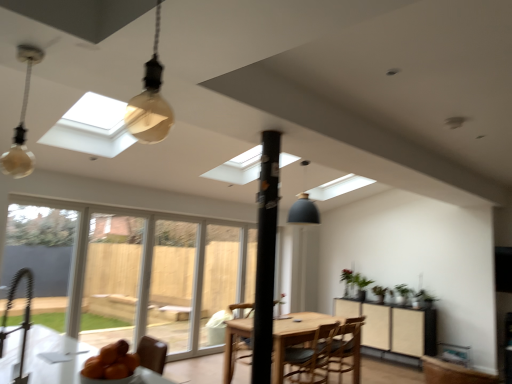
Question: Is transparent plastic screen door at center, which is counted as the 3th screen door, starting from the front, next to matte glass bulb at upper left?

Choices:
 (A) no
 (B) yes

Answer: (A)

Question: Can you confirm if transparent plastic screen door at center, which is counted as the 3th screen door, starting from the front, is wider than matte glass bulb at upper left?

Choices:
 (A) no
 (B) yes

Answer: (A)

Question: Is transparent plastic screen door at center, which is counted as the 3th screen door, starting from the front, closer to camera compared to matte glass bulb at upper left?

Choices:
 (A) no
 (B) yes

Answer: (A)

Question: Can you confirm if transparent plastic screen door at center, positioned as the first screen door in right-to-left order, is smaller than matte glass bulb at upper left?

Choices:
 (A) no
 (B) yes

Answer: (A)

Question: From a real-world perspective, does transparent plastic screen door at center, the third screen door when ordered from left to right, sit lower than matte glass bulb at upper left?

Choices:
 (A) yes
 (B) no

Answer: (A)

Question: Is transparent plastic screen door at center, positioned as the first screen door in right-to-left order, to the right of matte glass bulb at upper left from the viewer's perspective?

Choices:
 (A) no
 (B) yes

Answer: (B)

Question: From a real-world perspective, is transparent plastic screen door at center, the third screen door when ordered from left to right, located higher than green matte plant at right?

Choices:
 (A) yes
 (B) no

Answer: (B)

Question: Is transparent plastic screen door at center, positioned as the first screen door in right-to-left order, bigger than green matte plant at right?

Choices:
 (A) yes
 (B) no

Answer: (A)

Question: Considering the relative sizes of transparent plastic screen door at center, which is counted as the 3th screen door, starting from the front, and green matte plant at right in the image provided, is transparent plastic screen door at center, which is counted as the 3th screen door, starting from the front, taller than green matte plant at right?

Choices:
 (A) yes
 (B) no

Answer: (A)

Question: Does transparent plastic screen door at center, which is counted as the 3th screen door, starting from the front, have a greater width compared to green matte plant at right?

Choices:
 (A) yes
 (B) no

Answer: (B)

Question: Is transparent plastic screen door at center, which is counted as the 3th screen door, starting from the front, completely or partially outside of green matte plant at right?

Choices:
 (A) no
 (B) yes

Answer: (B)

Question: From the image's perspective, is transparent plastic screen door at center, positioned as the first screen door in right-to-left order, beneath green matte plant at right?

Choices:
 (A) yes
 (B) no

Answer: (B)

Question: From the image's perspective, does matte black cabinet at center right appear higher than matte glass bulb at upper left?

Choices:
 (A) yes
 (B) no

Answer: (B)